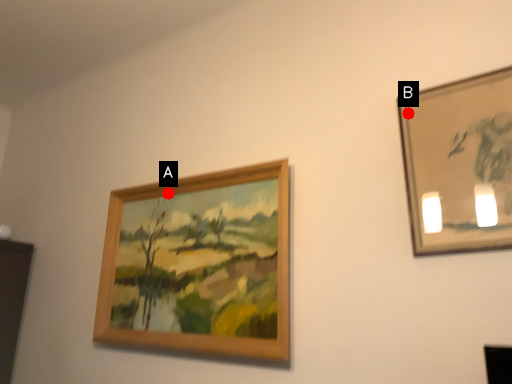
Question: Two points are circled on the image, labeled by A and B beside each circle. Among these points, which one is nearest to the camera?

Choices:
 (A) A is closer
 (B) B is closer

Answer: (B)